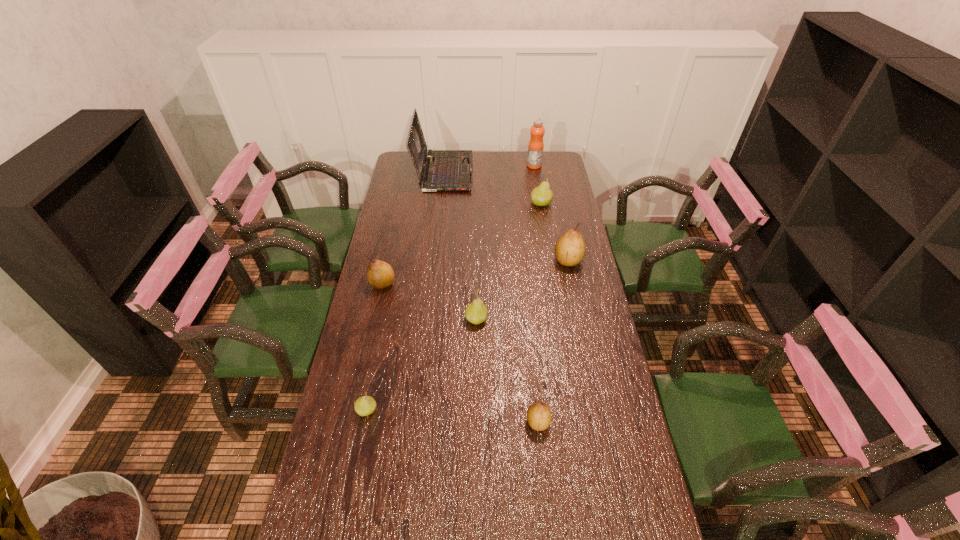
Identify the location of vacant area that lies between the third farthest pear and the third pear from left to right. (429, 301).

The width and height of the screenshot is (960, 540). In order to click on object that is the sixth closest to the fruit juice in this screenshot , I will do `click(539, 416)`.

Locate an element on the screen. object that is the nearest to the fourth object from right to left is located at coordinates (476, 312).

Point out which pear is positioned as the third nearest to the third farthest pear. Please provide its 2D coordinates. Your answer should be formatted as a tuple, i.e. [(x, y)], where the tuple contains the x and y coordinates of a point satisfying the conditions above.

[(570, 249)]

Locate which pear is the second closest to the rightmost brown pear. Please provide its 2D coordinates. Your answer should be formatted as a tuple, i.e. [(x, y)], where the tuple contains the x and y coordinates of a point satisfying the conditions above.

[(476, 312)]

What are the coordinates of `green pear object that ranks as the third closest to the laptop computer` in the screenshot? It's located at (365, 405).

This screenshot has width=960, height=540. Find the location of `green pear that stands as the second closest to the fruit juice`. green pear that stands as the second closest to the fruit juice is located at coordinates (476, 312).

The width and height of the screenshot is (960, 540). Find the location of `the second closest brown pear to the second farthest pear`. the second closest brown pear to the second farthest pear is located at coordinates (380, 275).

I want to click on brown pear identified as the closest to the fifth nearest object, so click(x=539, y=416).

The width and height of the screenshot is (960, 540). In order to click on vacant area in the image that satisfies the following two spatial constraints: 1. on the screen of the laptop computer; 2. on the back side of the fourth object from right to left in this screenshot , I will do `click(417, 422)`.